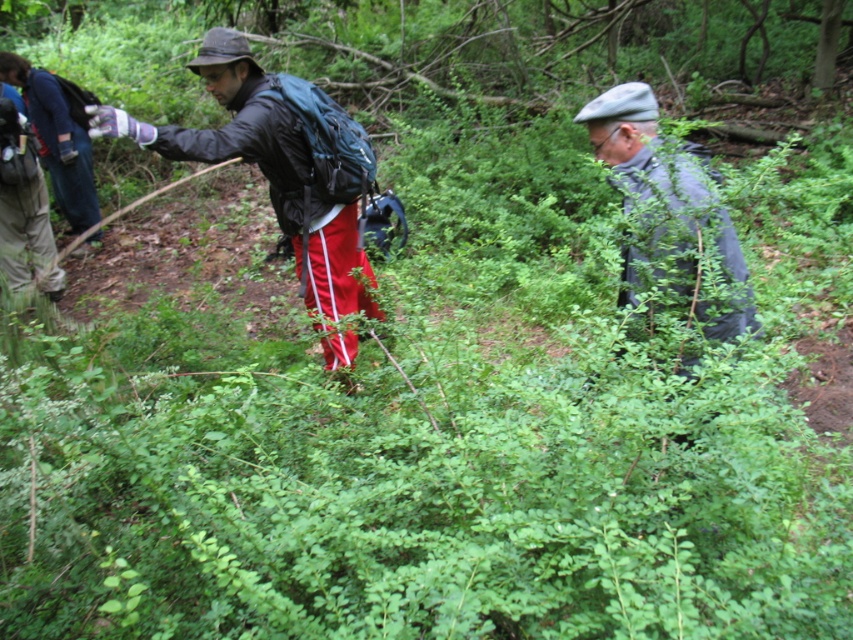
Question: Can you confirm if matte black jacket at center is positioned to the right of gray fabric jacket at center?

Choices:
 (A) no
 (B) yes

Answer: (A)

Question: Where is matte black jacket at center located in relation to gray fabric jacket at center in the image?

Choices:
 (A) above
 (B) below

Answer: (A)

Question: Is matte black jacket at center positioned behind gray fabric jacket at center?

Choices:
 (A) no
 (B) yes

Answer: (B)

Question: Which point is farther to the camera?

Choices:
 (A) gray fabric jacket at center
 (B) matte black jacket at center

Answer: (B)